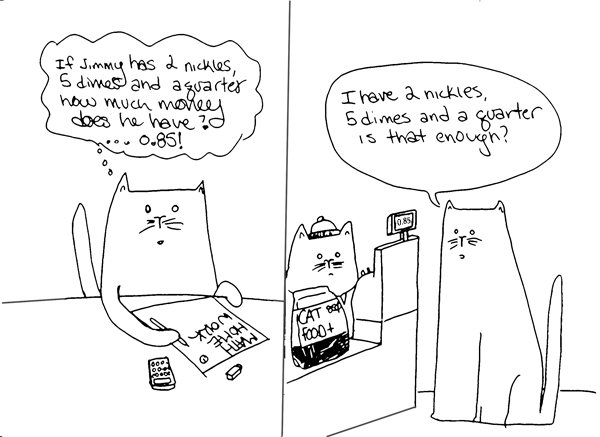
The height and width of the screenshot is (437, 600). What are the coordinates of `table` in the screenshot? It's located at (60, 303).